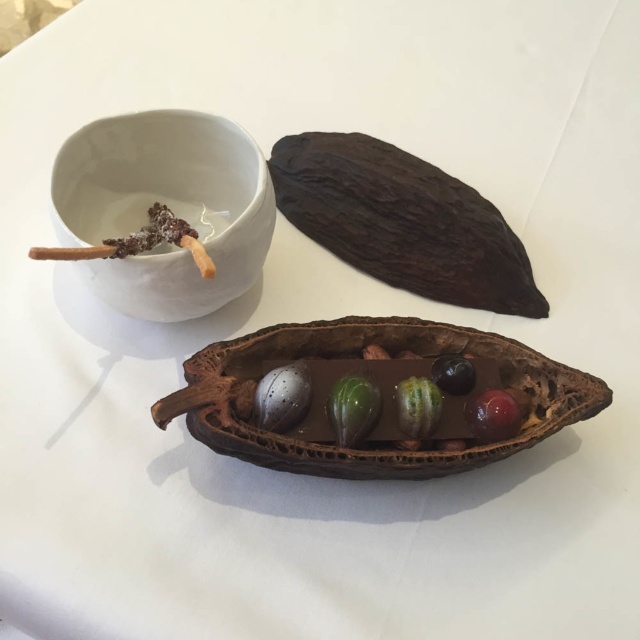
Question: Where is dark brown textured pod at upper center located in relation to green matte/glossy fruit at center in the image?

Choices:
 (A) below
 (B) above

Answer: (B)

Question: Which object is positioned farthest from the shiny dark blue berry at center?

Choices:
 (A) white ceramic bowl at upper left
 (B) dark brown textured pod at upper center

Answer: (A)

Question: Which of the following is the closest to the observer?

Choices:
 (A) (376, 410)
 (B) (493, 224)
 (C) (472, 400)

Answer: (A)

Question: From the image, what is the correct spatial relationship of matte gray stone at center in relation to glossy red berry at center?

Choices:
 (A) right
 (B) left

Answer: (B)

Question: Estimate the real-world distances between objects in this image. Which object is farther from the green glossy chocolate at center?

Choices:
 (A) glossy red berry at center
 (B) white ceramic bowl at upper left
 (C) green matte/glossy fruit at center

Answer: (B)

Question: Observing the image, what is the correct spatial positioning of matte gray stone at center in reference to glossy red berry at center?

Choices:
 (A) above
 (B) below

Answer: (A)